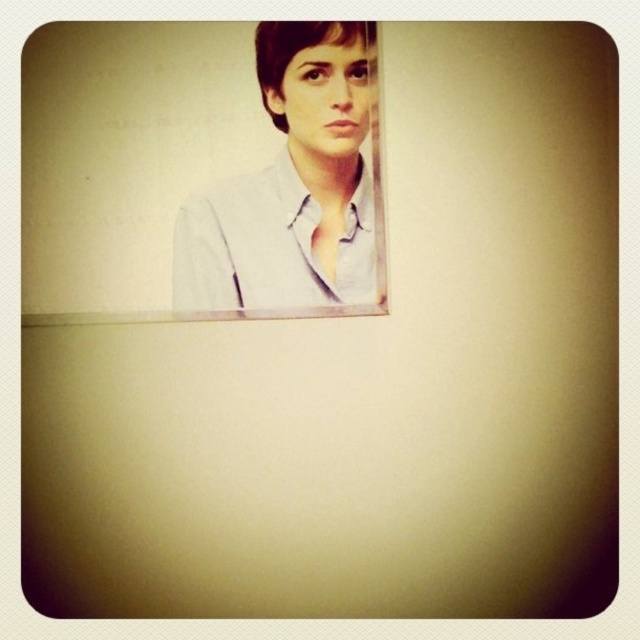
Question: Which point appears farthest from the camera in this image?

Choices:
 (A) (173, 266)
 (B) (360, 116)

Answer: (A)

Question: Does light blue shirt at upper center come in front of matte gray shirt at upper center?

Choices:
 (A) no
 (B) yes

Answer: (A)

Question: Does light blue shirt at upper center have a larger size compared to matte gray shirt at upper center?

Choices:
 (A) no
 (B) yes

Answer: (B)

Question: Which point is closer to the camera?

Choices:
 (A) (276, 113)
 (B) (285, 116)

Answer: (B)

Question: Is the position of light blue shirt at upper center less distant than that of matte gray shirt at upper center?

Choices:
 (A) yes
 (B) no

Answer: (B)